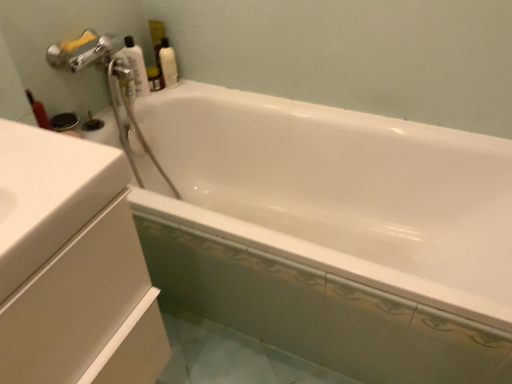
Question: Is there a large distance between white glossy bottle at upper left, placed as the 2th cleaning product when sorted from right to left, and white glossy bottle at upper right, the 1th cleaning product in the right-to-left sequence?

Choices:
 (A) yes
 (B) no

Answer: (B)

Question: Does white glossy bottle at upper left, placed as the 2th cleaning product when sorted from right to left, appear on the right side of white glossy bottle at upper right, placed as the second cleaning product when sorted from left to right?

Choices:
 (A) no
 (B) yes

Answer: (A)

Question: Does white glossy bottle at upper left, placed as the 2th cleaning product when sorted from right to left, touch white glossy bottle at upper right, placed as the second cleaning product when sorted from left to right?

Choices:
 (A) yes
 (B) no

Answer: (B)

Question: Is white glossy bottle at upper left, placed as the 2th cleaning product when sorted from right to left, further to camera compared to white glossy bottle at upper right, the 1th cleaning product in the right-to-left sequence?

Choices:
 (A) no
 (B) yes

Answer: (A)

Question: Can you confirm if white glossy bottle at upper left, the first cleaning product positioned from the left, is shorter than white glossy bottle at upper right, the 1th cleaning product in the right-to-left sequence?

Choices:
 (A) yes
 (B) no

Answer: (B)

Question: Is white glossy bottle at upper right, placed as the second cleaning product when sorted from left to right, in front of or behind white glossy bottle at upper left, placed as the 2th cleaning product when sorted from right to left, in the image?

Choices:
 (A) behind
 (B) front

Answer: (A)

Question: Considering the positions of point (167, 74) and point (135, 44), is point (167, 74) closer or farther from the camera than point (135, 44)?

Choices:
 (A) closer
 (B) farther

Answer: (B)

Question: In terms of width, does white glossy bottle at upper right, placed as the second cleaning product when sorted from left to right, look wider or thinner when compared to white glossy bottle at upper left, the first cleaning product positioned from the left?

Choices:
 (A) thin
 (B) wide

Answer: (A)

Question: From their relative heights in the image, would you say white glossy bottle at upper right, the 1th cleaning product in the right-to-left sequence, is taller or shorter than white glossy bottle at upper left, placed as the 2th cleaning product when sorted from right to left?

Choices:
 (A) short
 (B) tall

Answer: (A)

Question: Considering the positions of white glossy bottle at upper right, placed as the second cleaning product when sorted from left to right, and white glossy bathtub at upper center in the image, is white glossy bottle at upper right, placed as the second cleaning product when sorted from left to right, taller or shorter than white glossy bathtub at upper center?

Choices:
 (A) short
 (B) tall

Answer: (A)

Question: Would you say white glossy bottle at upper right, placed as the second cleaning product when sorted from left to right, is to the left or to the right of white glossy bathtub at upper center in the picture?

Choices:
 (A) left
 (B) right

Answer: (A)

Question: Is white glossy bottle at upper right, placed as the second cleaning product when sorted from left to right, bigger or smaller than white glossy bathtub at upper center?

Choices:
 (A) big
 (B) small

Answer: (B)

Question: Does point (168, 87) appear closer or farther from the camera than point (268, 168)?

Choices:
 (A) farther
 (B) closer

Answer: (A)

Question: Is white glossy bottle at upper left, the first cleaning product positioned from the left, bigger or smaller than white glossy cabinet at left?

Choices:
 (A) small
 (B) big

Answer: (A)

Question: Does point (140, 89) appear closer or farther from the camera than point (42, 165)?

Choices:
 (A) closer
 (B) farther

Answer: (B)